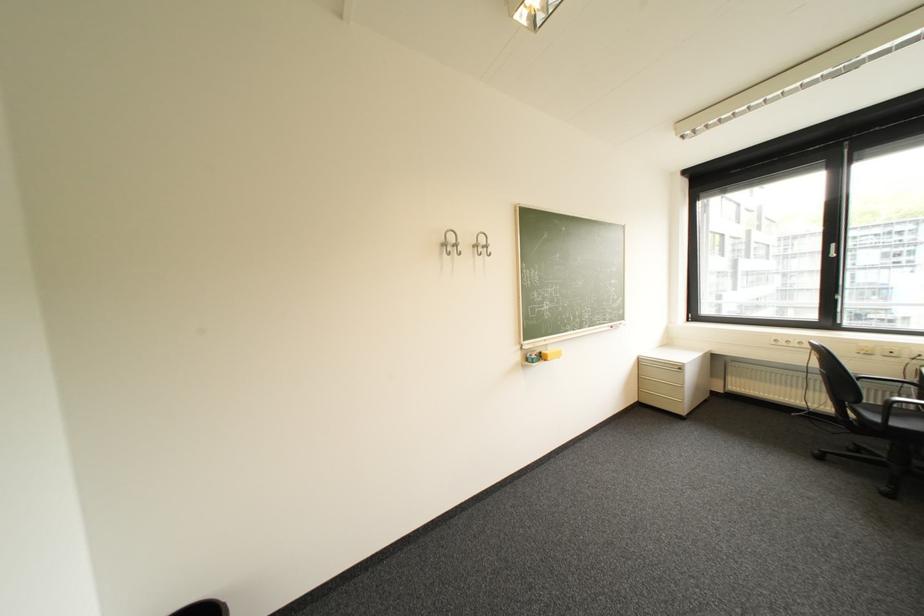
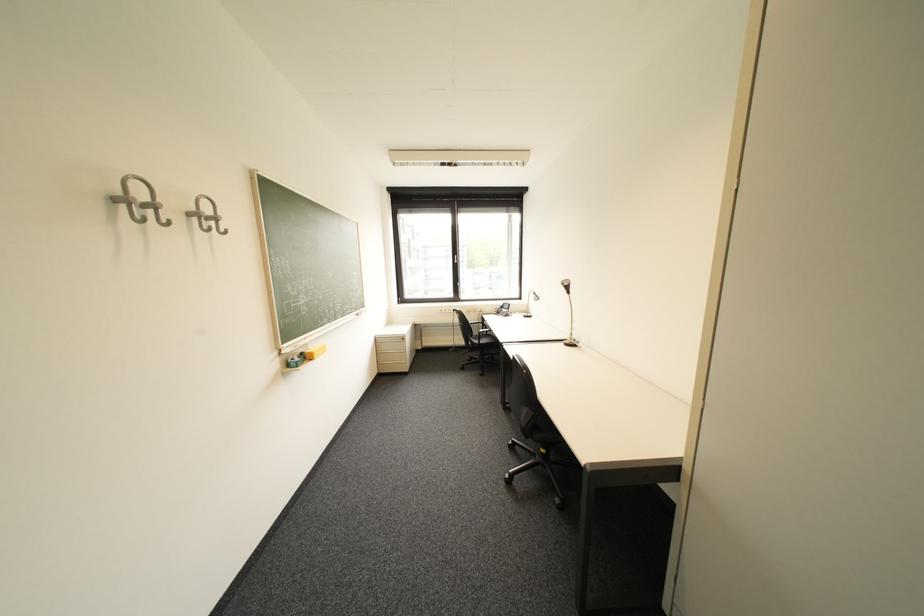
Where in the second image is the point corresponding to (x=455, y=245) from the first image?

(130, 201)